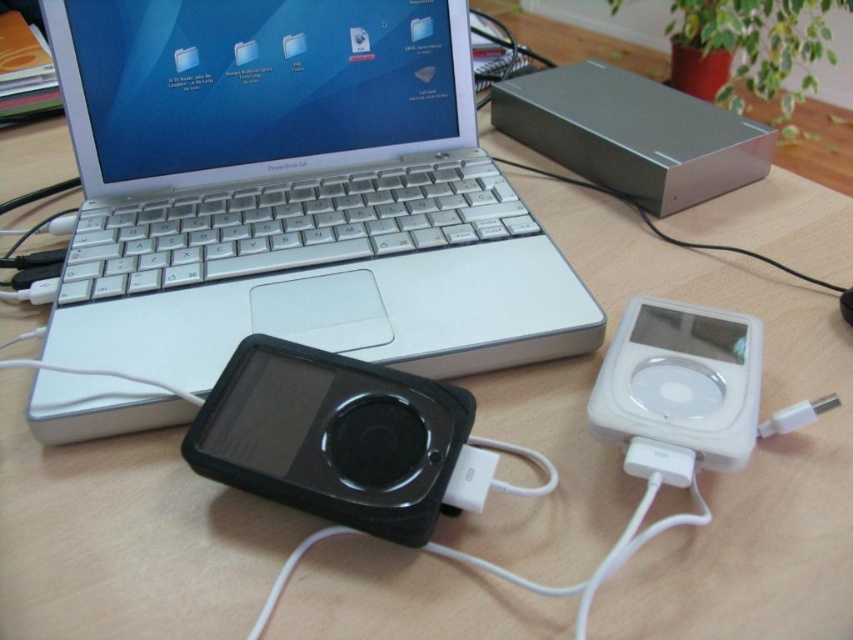
You are organizing cables on a desk and need to connect the white plastic usb plug at center to the silver metallic laptop at center. Which object should you plug the USB plug into first?

The white plastic usb plug at center should be plugged into the silver metallic laptop at center first since the silver metallic laptop at center is closer to the viewer, making it easier to access.

You are setting up a new device and need to connect the white glossy ipod at right to the white plastic usb plug at center. Given that the USB cable you have is 8 centimeters long, will it be sufficient to connect them without any extension?

The distance between the white glossy ipod at right and the white plastic usb plug at center is 9.17 centimeters. Since the USB cable is only 8 centimeters long, it is shorter than the required distance. Therefore, the cable will not be sufficient, and an extension may be needed.

You are organizing a display and need to place a protective cover over both the black rubberized mp3 player at center and the white glossy ipod at right. Which one should you cover first if you want to cover the one closer to you first?

You should cover the black rubberized mp3 player at center first because it is closer to the viewer than the white glossy ipod at right.